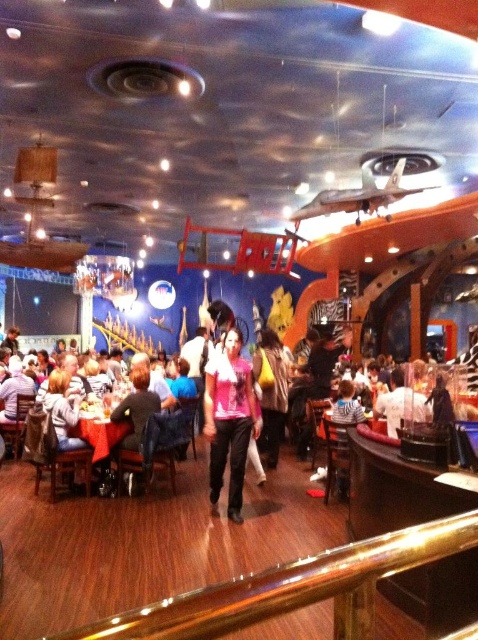
Which is more to the right, pink fabric shirt at center or red tablecloth at lower left?

pink fabric shirt at center is more to the right.

Does pink fabric shirt at center have a greater height compared to red tablecloth at lower left?

Yes, pink fabric shirt at center is taller than red tablecloth at lower left.

Image resolution: width=478 pixels, height=640 pixels. I want to click on pink fabric shirt at center, so click(x=228, y=419).

Looking at this image, between shiny polished wood rail at lower center and red tablecloth at lower left, which one is positioned higher?

Positioned higher is shiny polished wood rail at lower center.

Between point (268, 600) and point (115, 438), which one is positioned in front?

Point (268, 600) is in front.

The width and height of the screenshot is (478, 640). In order to click on shiny polished wood rail at lower center in this screenshot , I will do `click(293, 588)`.

Consider the image. Is shiny polished wood rail at lower center further to the viewer compared to pink fabric shirt at center?

That is False.

Does shiny polished wood rail at lower center have a smaller size compared to pink fabric shirt at center?

Yes.

Is point (282, 596) in front of point (209, 442)?

Yes, it is.

The width and height of the screenshot is (478, 640). Identify the location of shiny polished wood rail at lower center. (293, 588).